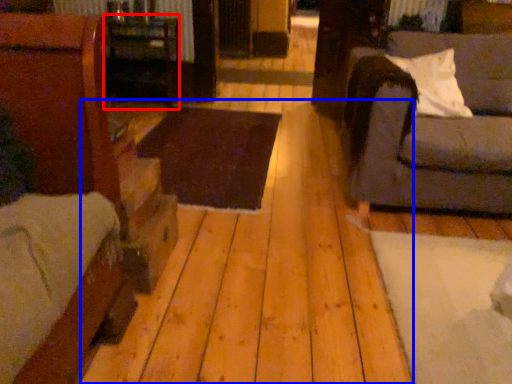
Question: Which of the following is the farthest to the observer, table (highlighted by a red box) or plywood (highlighted by a blue box)?

Choices:
 (A) table
 (B) plywood

Answer: (A)